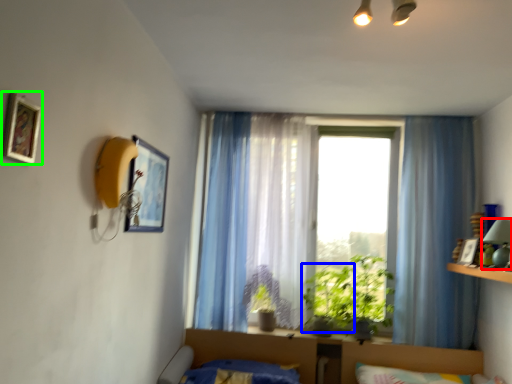
Question: Considering the real-world distances, which object is closest to lamp (highlighted by a red box)? plant (highlighted by a blue box) or picture frame (highlighted by a green box).

Choices:
 (A) plant
 (B) picture frame

Answer: (A)